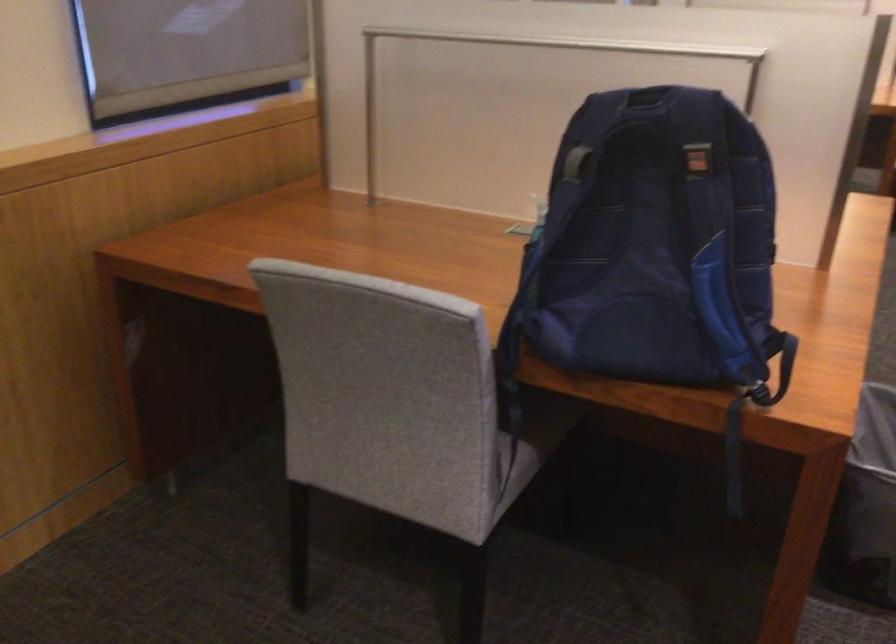
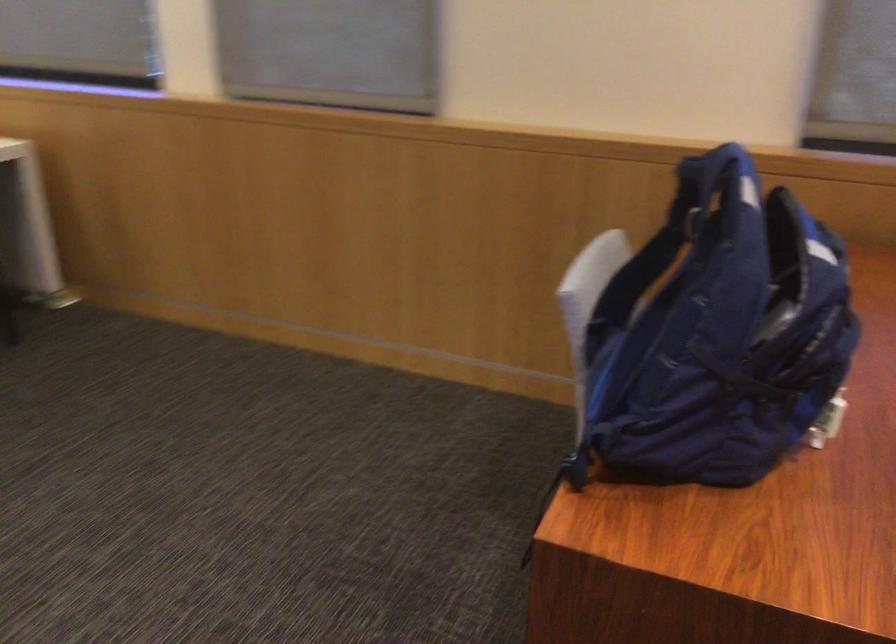
Find the pixel in the second image that matches point 668,149 in the first image.

(687, 216)